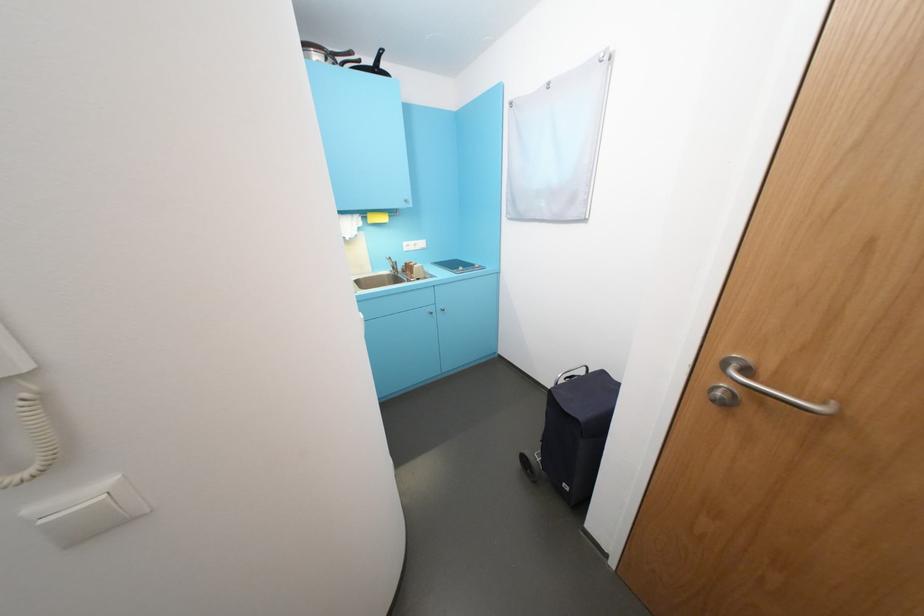
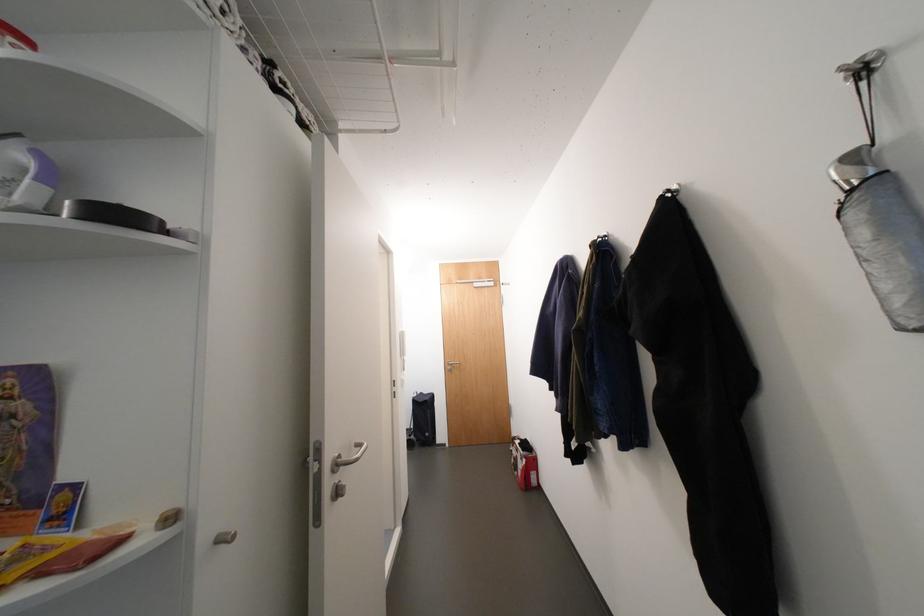
In the second image, find the point that corresponds to point (585, 421) in the first image.

(433, 402)